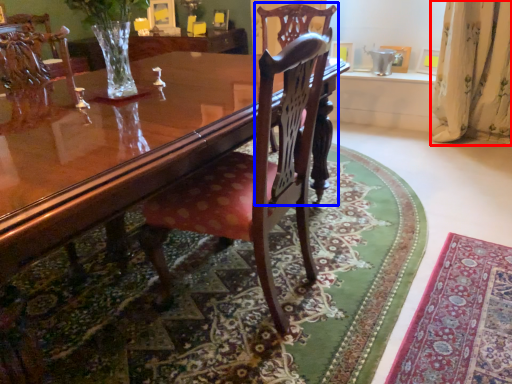
Question: Among these objects, which one is farthest to the camera, curtain (highlighted by a red box) or chair (highlighted by a blue box)?

Choices:
 (A) curtain
 (B) chair

Answer: (A)